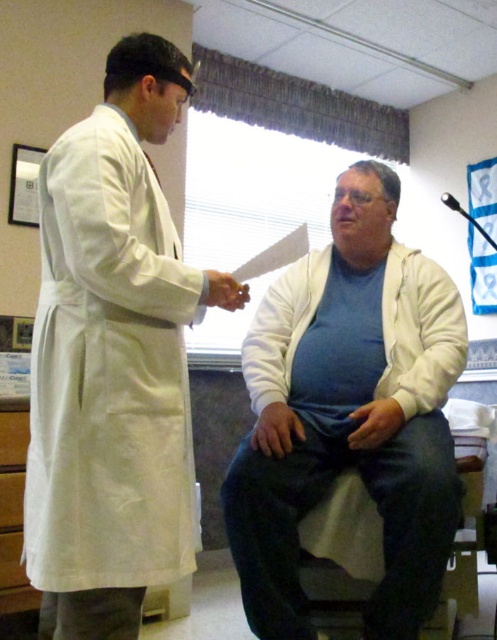
Is white smooth lab coat at left positioned behind white matte jacket at center?

That is False.

Between point (180, 484) and point (363, 364), which one is positioned in front?

Positioned in front is point (180, 484).

You are a GUI agent. You are given a task and a screenshot of the screen. Output one action in this format:
    pyautogui.click(x=<x>, y=<y>)
    Task: Click on the white smooth lab coat at left
    This screenshot has width=497, height=640.
    Given the screenshot: What is the action you would take?
    pyautogui.click(x=112, y=358)

Measure the distance between white smooth lab coat at left and white fleece jacket at center.

The distance of white smooth lab coat at left from white fleece jacket at center is 57.96 centimeters.

Who is taller, white smooth lab coat at left or white fleece jacket at center?

Standing taller between the two is white smooth lab coat at left.

Does point (75, 333) lie behind point (439, 328)?

That is False.

Identify the location of white smooth lab coat at left. (112, 358).

You are a GUI agent. You are given a task and a screenshot of the screen. Output one action in this format:
    pyautogui.click(x=<x>, y=<y>)
    Task: Click on the white matte jacket at center
    This screenshot has height=640, width=497.
    Given the screenshot: What is the action you would take?
    pyautogui.click(x=349, y=413)